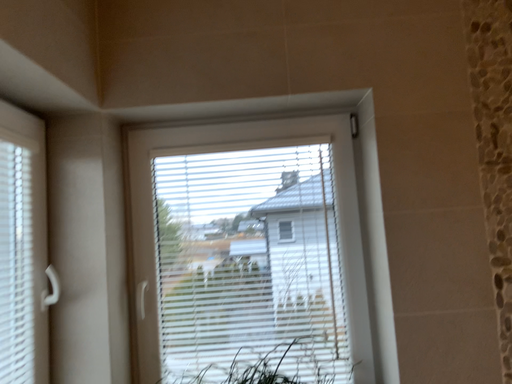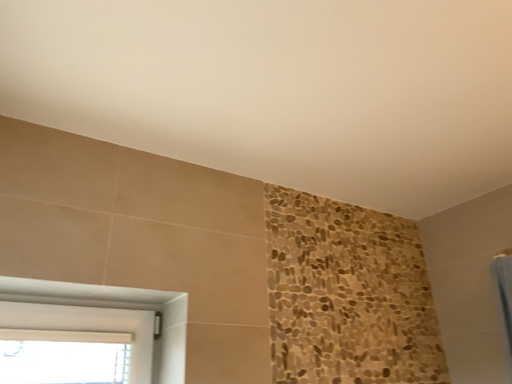
Question: Which way did the camera rotate in the video?

Choices:
 (A) rotated upward
 (B) rotated downward

Answer: (A)